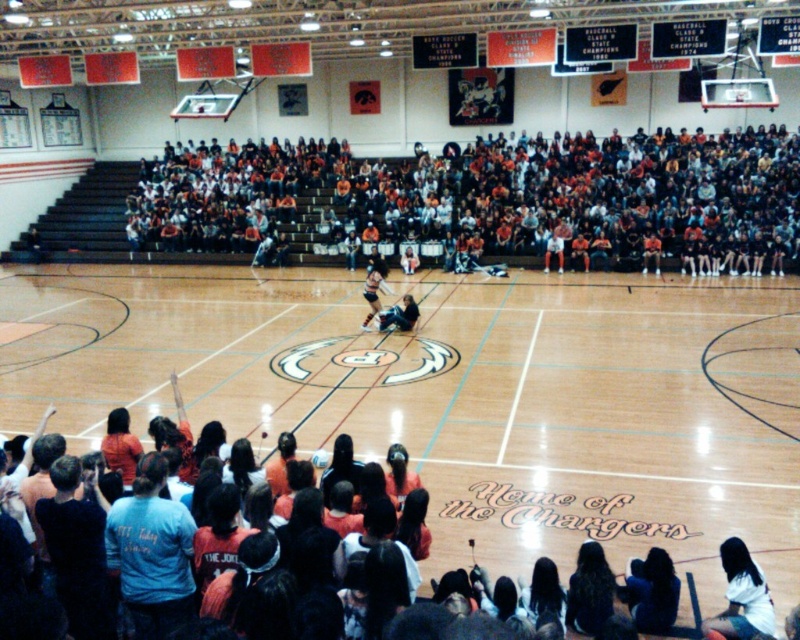
You are a photographer standing at the back of the gymnasium, and you want to take a photo of the matte black person at center and the orange jersey at center. Which one is closer to the camera?

The matte black person at center is closer to the camera because they are positioned below the orange jersey at center, meaning they are in a lower, nearer position relative to the photographer at the back.

You are standing at the back of the gymnasium and want to take a photo of both the point at coordinates point (738,612) and point (380,321). Which point should you focus on first to ensure both are in focus?

You should focus on point (738,612) first because it is closer to the camera than point (380,321), so adjusting focus from near to far will help ensure both points are in focus.

You are standing at the entrance of the gymnasium and notice two people in the scene. One is wearing a white cotton shirt at lower right, and the other is a matte black person at center. Which person is closer to the right side of the gymnasium?

The white cotton shirt at lower right is to the right of the matte black person at center, so the person in the white cotton shirt at lower right is closer to the right side of the gymnasium.